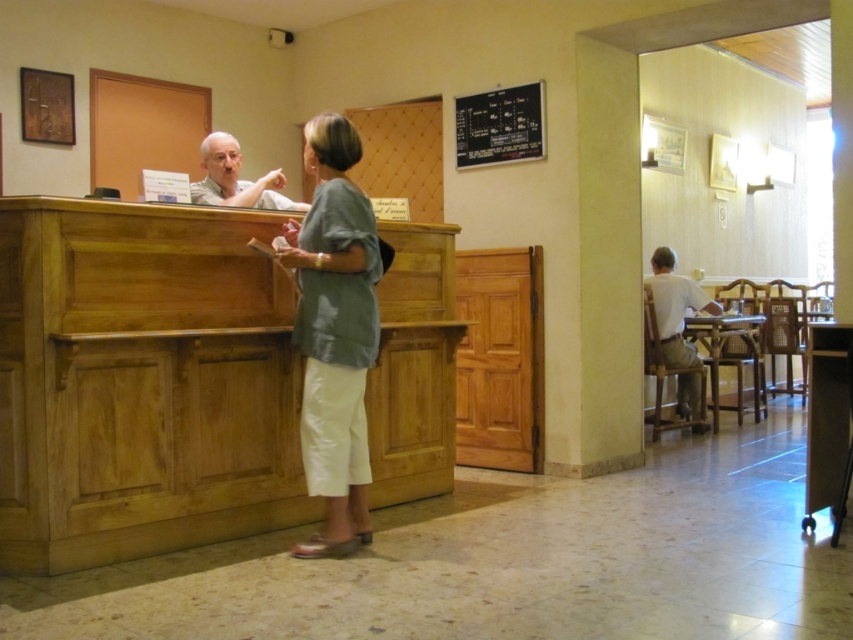
Is blackboard at upper center closer to camera compared to white matte shirt at right?

Yes, it is.

Is blackboard at upper center smaller than white matte shirt at right?

Yes.

Between point (459, 128) and point (666, 337), which one is positioned in front?

Point (459, 128) is in front.

I want to click on blackboard at upper center, so click(x=500, y=125).

Between light green fabric blouse at center and matte white shirt at left, which one is positioned higher?

matte white shirt at left is above.

Between light green fabric blouse at center and matte white shirt at left, which one appears on the right side from the viewer's perspective?

light green fabric blouse at center

Is point (344, 445) positioned in front of point (206, 163)?

Yes, it is in front of point (206, 163).

Locate an element on the screen. The height and width of the screenshot is (640, 853). light green fabric blouse at center is located at coordinates (335, 332).

Does white matte shirt at right appear under matte white shirt at left?

Indeed, white matte shirt at right is positioned under matte white shirt at left.

Based on the photo, how far apart are white matte shirt at right and matte white shirt at left?

A distance of 3.34 meters exists between white matte shirt at right and matte white shirt at left.

Which is in front, point (666, 264) or point (276, 198)?

Positioned in front is point (276, 198).

You are a GUI agent. You are given a task and a screenshot of the screen. Output one action in this format:
    pyautogui.click(x=<x>, y=<y>)
    Task: Click on the white matte shirt at right
    The image size is (853, 640).
    Given the screenshot: What is the action you would take?
    pyautogui.click(x=674, y=307)